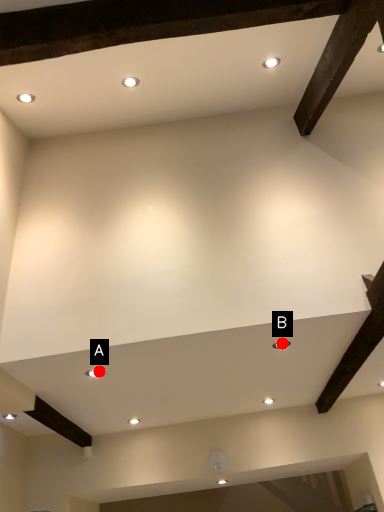
Question: Two points are circled on the image, labeled by A and B beside each circle. Which point is closer to the camera taking this photo?

Choices:
 (A) A is closer
 (B) B is closer

Answer: (B)